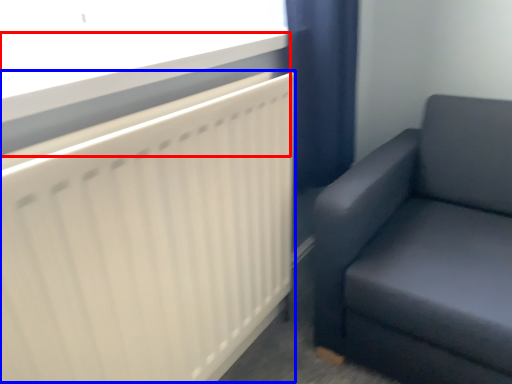
Question: Among these objects, which one is nearest to the camera, window sill (highlighted by a red box) or radiator (highlighted by a blue box)?

Choices:
 (A) window sill
 (B) radiator

Answer: (B)